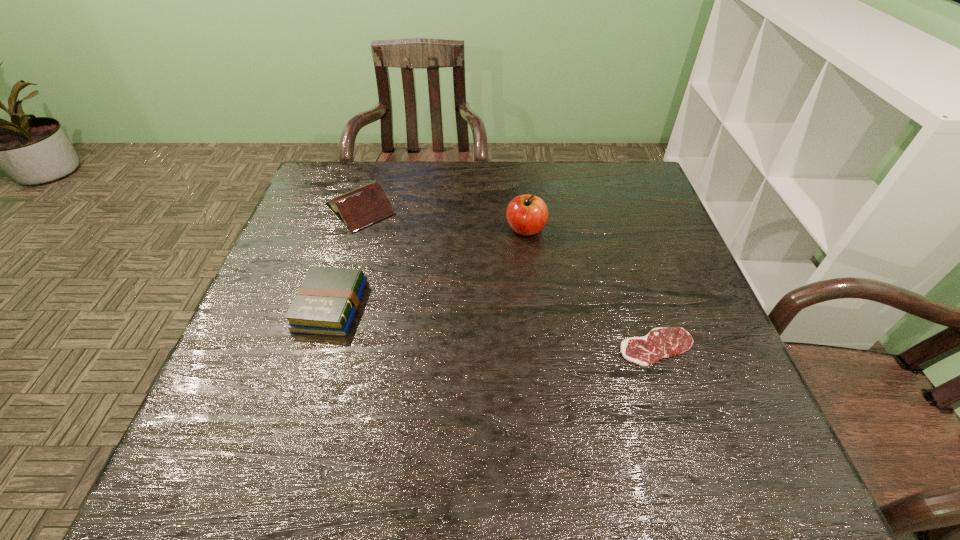
The image size is (960, 540). I want to click on vacant space that's between the tallest object and the third tallest object, so click(x=428, y=267).

Locate an element on the screen. free area in between the apple and the rightmost object is located at coordinates (591, 288).

I want to click on object that stands as the third closest to the farther book, so click(x=659, y=343).

Image resolution: width=960 pixels, height=540 pixels. I want to click on the second closest object to the third object from left to right, so click(x=659, y=343).

This screenshot has width=960, height=540. Identify the location of free location that satisfies the following two spatial constraints: 1. on the front side of the apple; 2. on the right side of the taller book. (353, 229).